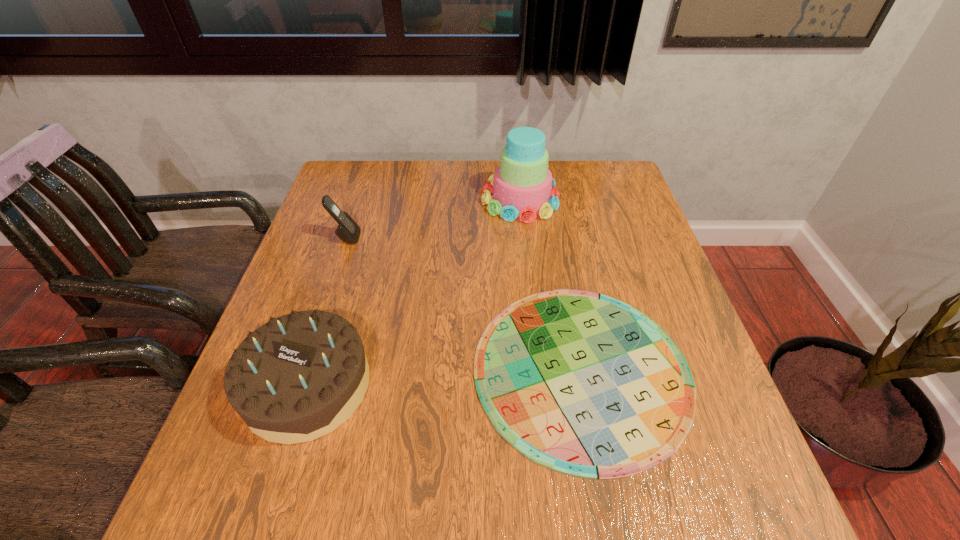
The height and width of the screenshot is (540, 960). I want to click on empty space between the cellular telephone and the shortest object, so click(464, 303).

Image resolution: width=960 pixels, height=540 pixels. I want to click on vacant space that is in between the gameboard and the birthday cake, so click(x=444, y=377).

Image resolution: width=960 pixels, height=540 pixels. In order to click on empty space that is in between the birthday cake and the cake in this screenshot , I will do `click(414, 292)`.

You are a GUI agent. You are given a task and a screenshot of the screen. Output one action in this format:
    pyautogui.click(x=<x>, y=<y>)
    Task: Click on the vacant region between the birthday cake and the shortest object
    The image size is (960, 540).
    Given the screenshot: What is the action you would take?
    pyautogui.click(x=444, y=377)

At what (x,y) coordinates should I click in order to perform the action: click on vacant point located between the gameboard and the cellular telephone. Please return your answer as a coordinate pair (x, y). Looking at the image, I should click on (464, 303).

At what (x,y) coordinates should I click in order to perform the action: click on free space between the farthest object and the gameboard. Please return your answer as a coordinate pair (x, y). This screenshot has width=960, height=540. Looking at the image, I should click on pyautogui.click(x=551, y=284).

Locate an element on the screen. The width and height of the screenshot is (960, 540). free space that is in between the cellular telephone and the birthday cake is located at coordinates (326, 312).

You are a GUI agent. You are given a task and a screenshot of the screen. Output one action in this format:
    pyautogui.click(x=<x>, y=<y>)
    Task: Click on the free space between the gameboard and the cellular telephone
    The width and height of the screenshot is (960, 540).
    Given the screenshot: What is the action you would take?
    coord(464,303)

The width and height of the screenshot is (960, 540). What are the coordinates of `empty location between the cake and the birthday cake` in the screenshot? It's located at (414, 292).

Locate which object ranks in proximity to the cake. Please provide its 2D coordinates. Your answer should be formatted as a tuple, i.e. [(x, y)], where the tuple contains the x and y coordinates of a point satisfying the conditions above.

[(584, 384)]